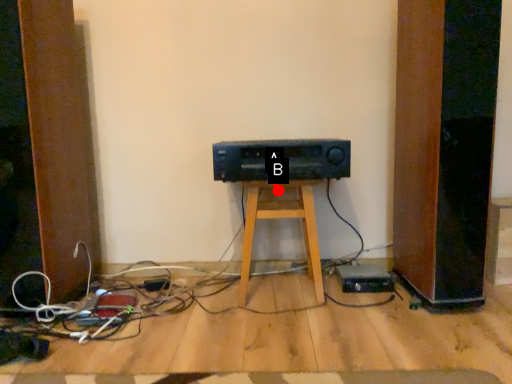
Question: Two points are circled on the image, labeled by A and B beside each circle. Among these points, which one is farthest from the camera?

Choices:
 (A) A is further
 (B) B is further

Answer: (B)